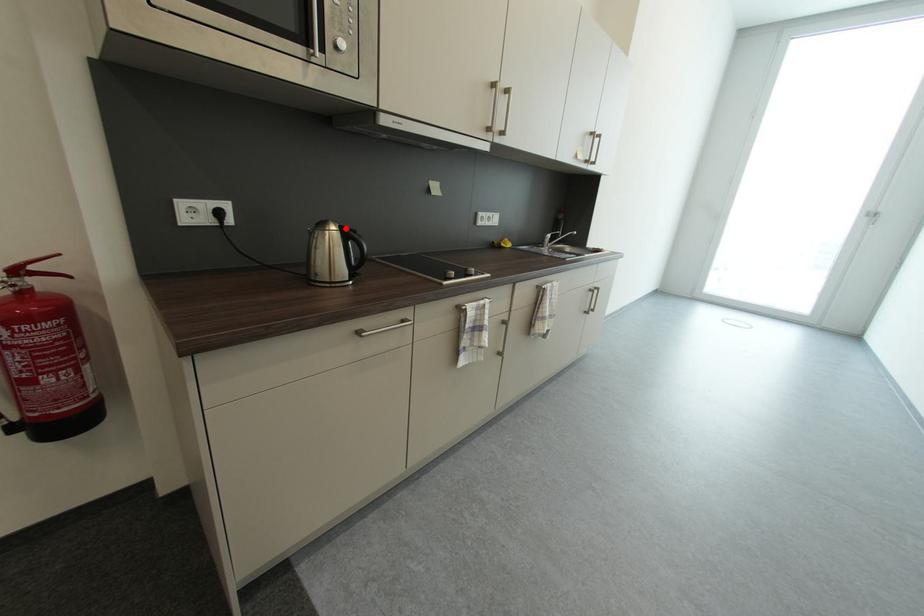
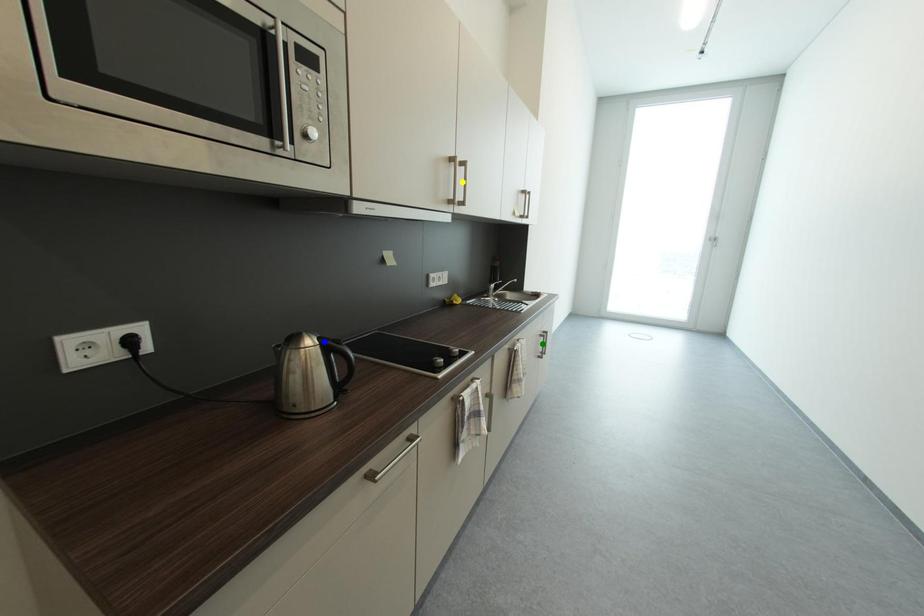
Question: I am providing you with two images of the same scene from different viewpoints. A red point is marked on the first image. You are given multiple points on the second image. Which point in image 2 represents the same 3d spot as the red point in image 1?

Choices:
 (A) green point
 (B) blue point
 (C) yellow point

Answer: (B)